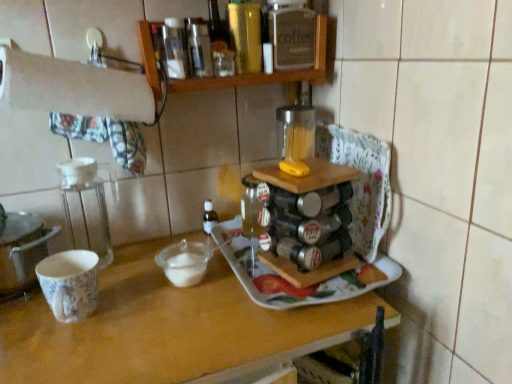
Question: Is the depth of porcelain floral mug at left greater than that of wooden spice rack at upper center?

Choices:
 (A) no
 (B) yes

Answer: (A)

Question: Is porcelain floral mug at left located outside wooden spice rack at upper center?

Choices:
 (A) yes
 (B) no

Answer: (A)

Question: Does porcelain floral mug at left have a lesser width compared to wooden spice rack at upper center?

Choices:
 (A) yes
 (B) no

Answer: (A)

Question: Does porcelain floral mug at left have a larger size compared to wooden spice rack at upper center?

Choices:
 (A) no
 (B) yes

Answer: (A)

Question: Could you tell me if porcelain floral mug at left is turned towards wooden spice rack at upper center?

Choices:
 (A) yes
 (B) no

Answer: (B)

Question: Is metallic silver spice rack at center inside or outside of transparent plastic container at left?

Choices:
 (A) inside
 (B) outside

Answer: (B)

Question: Considering their positions, is metallic silver spice rack at center located in front of or behind transparent plastic container at left?

Choices:
 (A) behind
 (B) front

Answer: (B)

Question: Is point (322, 147) positioned closer to the camera than point (88, 180)?

Choices:
 (A) farther
 (B) closer

Answer: (A)

Question: Looking at their shapes, would you say metallic silver spice rack at center is wider or thinner than transparent plastic container at left?

Choices:
 (A) thin
 (B) wide

Answer: (A)

Question: From a real-world perspective, is wooden spice rack at upper center physically located above or below white paper towel at upper left?

Choices:
 (A) above
 (B) below

Answer: (A)

Question: Is wooden spice rack at upper center bigger or smaller than white paper towel at upper left?

Choices:
 (A) small
 (B) big

Answer: (B)

Question: Relative to white paper towel at upper left, is wooden spice rack at upper center in front or behind?

Choices:
 (A) behind
 (B) front

Answer: (A)

Question: Is wooden spice rack at upper center situated inside white paper towel at upper left or outside?

Choices:
 (A) outside
 (B) inside

Answer: (A)

Question: Considering the positions of point (174, 253) and point (7, 49), is point (174, 253) closer or farther from the camera than point (7, 49)?

Choices:
 (A) closer
 (B) farther

Answer: (B)

Question: Would you say transparent glass mixing bowl at center is to the left or to the right of white paper towel at upper left in the picture?

Choices:
 (A) right
 (B) left

Answer: (A)